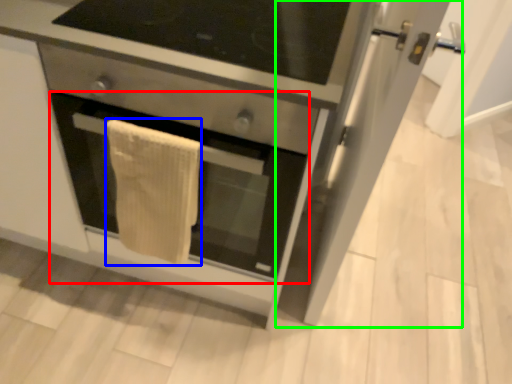
Question: Which object is the farthest from oven (highlighted by a red box)? Choose among these: bath towel (highlighted by a blue box) or glass door (highlighted by a green box).

Choices:
 (A) bath towel
 (B) glass door

Answer: (B)